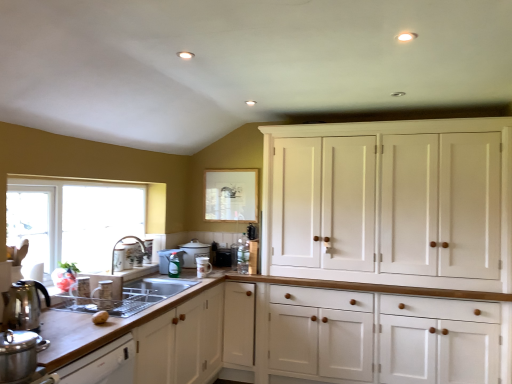
The width and height of the screenshot is (512, 384). I want to click on free area behind shiny metallic kettle at left, so click(x=59, y=315).